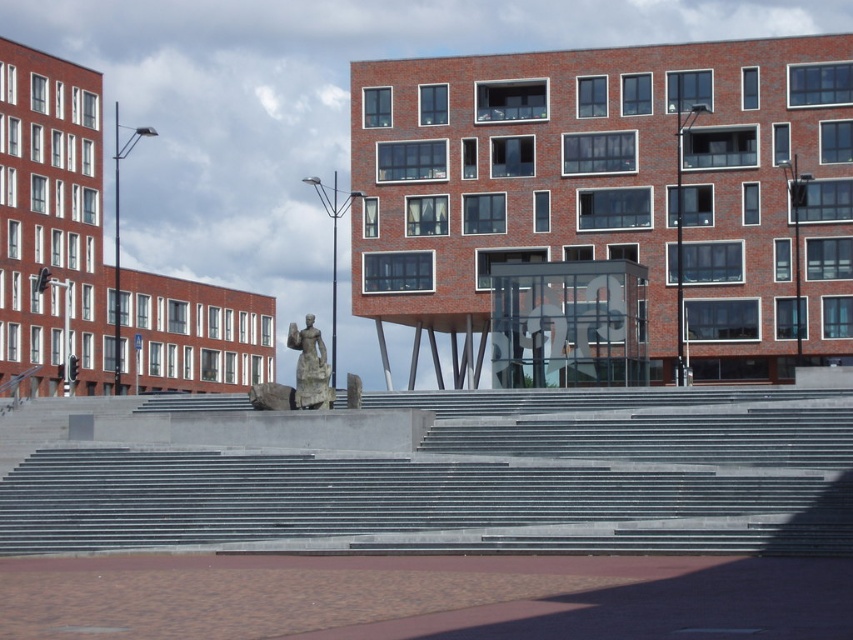
Question: Is smooth concrete stairs at center bigger than stone statue at center?

Choices:
 (A) yes
 (B) no

Answer: (A)

Question: Which object appears closest to the camera in this image?

Choices:
 (A) smooth concrete stairs at center
 (B) bronze statue at center
 (C) stone statue at center

Answer: (A)

Question: Can you confirm if stone statue at center is positioned below polished bronze statue at center?

Choices:
 (A) yes
 (B) no

Answer: (B)

Question: Is smooth concrete stairs at center bigger than stone statue at center?

Choices:
 (A) no
 (B) yes

Answer: (B)

Question: Estimate the real-world distances between objects in this image. Which object is farther from the polished bronze statue at center?

Choices:
 (A) stone statue at center
 (B) smooth concrete stairs at center
 (C) bronze statue at center

Answer: (C)

Question: Based on their relative distances, which object is farther from the stone statue at center?

Choices:
 (A) smooth concrete stairs at center
 (B) polished bronze statue at center

Answer: (B)